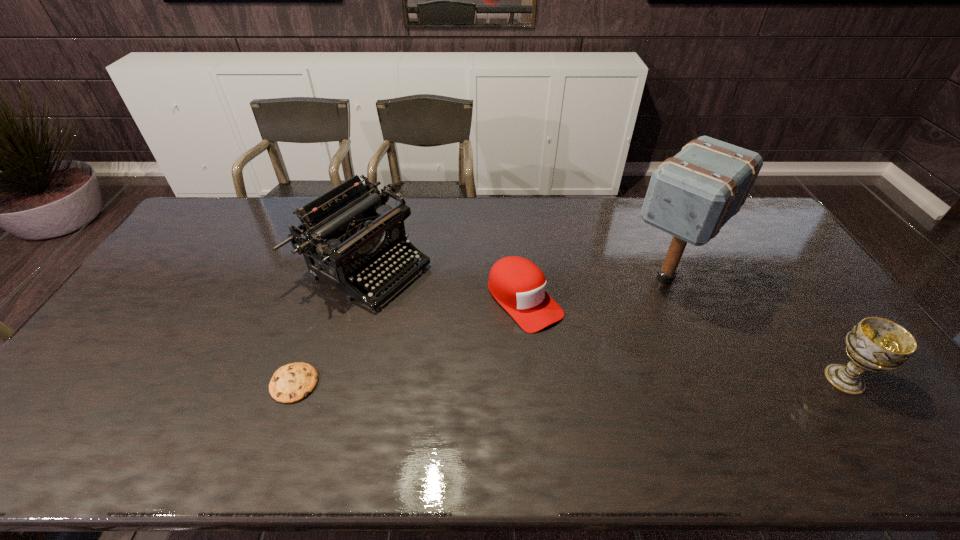
You are a GUI agent. You are given a task and a screenshot of the screen. Output one action in this format:
    pyautogui.click(x=<x>, y=<y>)
    Task: Click on the vacant space that satisfies the following two spatial constraints: 1. on the back side of the mallet; 2. on the right side of the shortest object
    This screenshot has height=540, width=960.
    Given the screenshot: What is the action you would take?
    pyautogui.click(x=331, y=279)